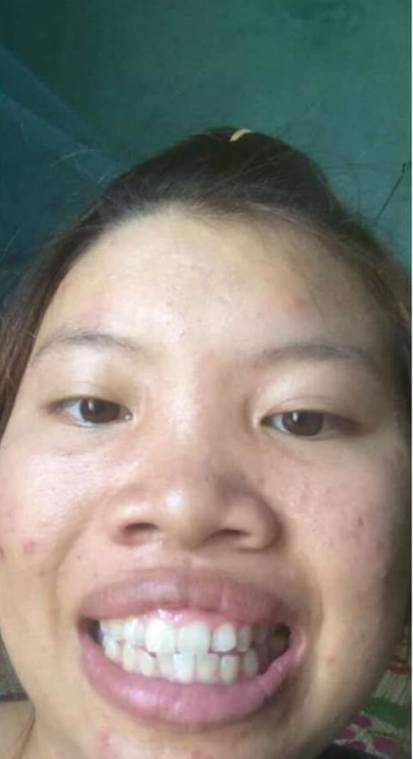
The height and width of the screenshot is (759, 413). Identify the location of backdrop. (54, 206), (397, 191).